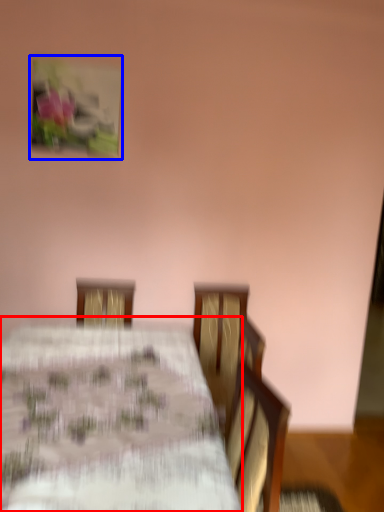
Question: Which object appears closest to the camera in this image, table (highlighted by a red box) or picture frame (highlighted by a blue box)?

Choices:
 (A) table
 (B) picture frame

Answer: (A)